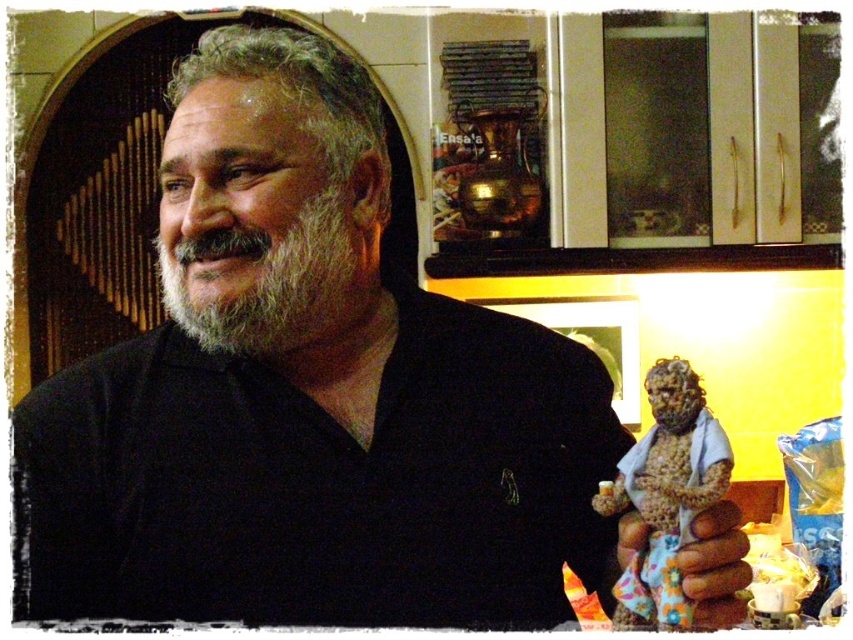
Question: Is graywoollybeard at left wider than brown textured hand at lower right?

Choices:
 (A) no
 (B) yes

Answer: (B)

Question: Which point appears farthest from the camera in this image?

Choices:
 (A) (630, 486)
 (B) (288, 273)

Answer: (B)

Question: Which of these objects is positioned closest to the brown textured hand at lower right?

Choices:
 (A) graywoollybeard at left
 (B) textured brown figurine at right

Answer: (B)

Question: Based on their relative distances, which object is farther from the brown textured hand at lower right?

Choices:
 (A) graywoollybeard at left
 (B) textured brown figurine at right

Answer: (A)

Question: From the image, what is the correct spatial relationship of graywoollybeard at left in relation to textured brown figurine at right?

Choices:
 (A) below
 (B) above

Answer: (B)

Question: Can you confirm if graywoollybeard at left is bigger than textured brown figurine at right?

Choices:
 (A) no
 (B) yes

Answer: (B)